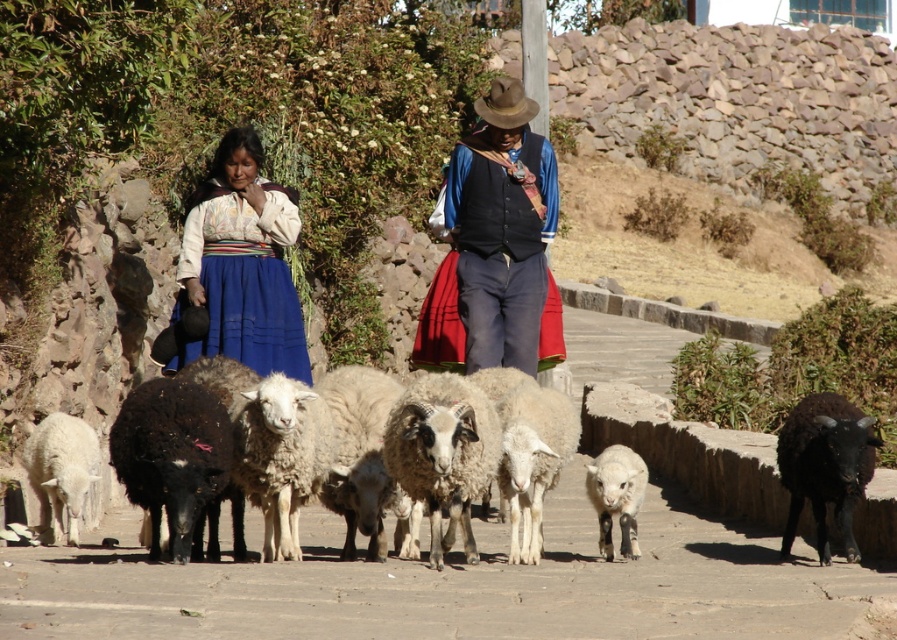
You are a photographer trying to capture the scene with a focus on the matte blue skirt at center and the white woolly lamb at center. From your perspective, which object is positioned higher in the image?

The matte blue skirt at center is above the white woolly lamb at center, so the matte blue skirt at center is positioned higher in the image.

Consider the image. You are standing at the starting point of the pathway and want to reach a destination located at point [863,420]. There is an obstacle at point [497,304]. Will you encounter the obstacle before reaching your destination?

Yes, you will encounter the obstacle at point [497,304] before reaching the destination at point [863,420] because point [497,304] is closer to you than point [863,420].